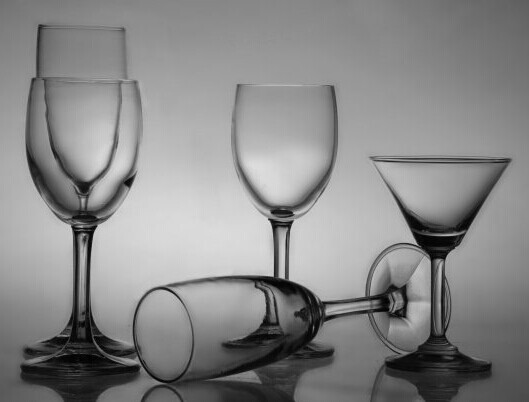
At what (x,y) coordinates should I click in order to perform the action: click on cup portion of glass. Please return your answer as a coordinate pair (x, y). Looking at the image, I should click on tap(213, 326), tap(437, 189), tap(285, 144), tap(53, 177), tap(79, 53).